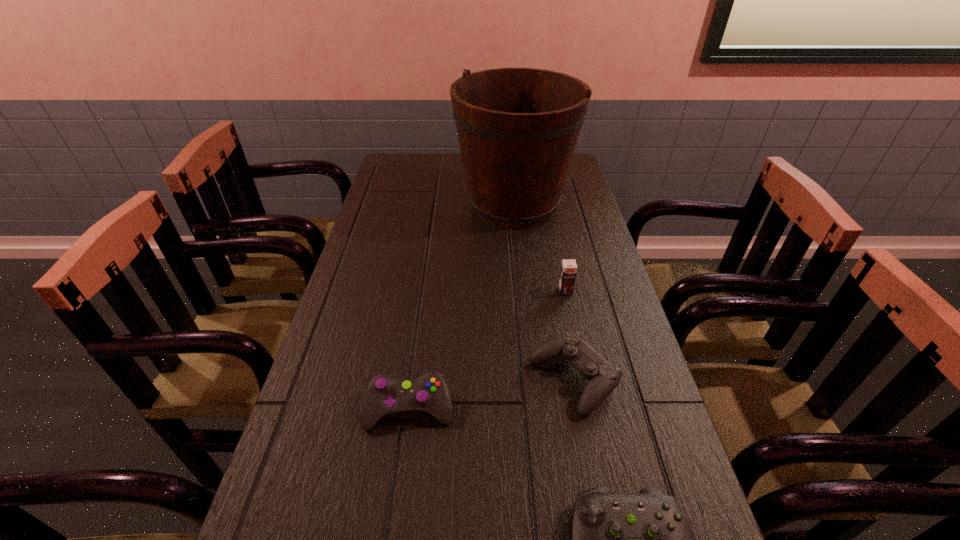
The image size is (960, 540). In order to click on blank region between the leftmost control and the fourth shortest object in this screenshot , I will do `click(488, 350)`.

You are a GUI agent. You are given a task and a screenshot of the screen. Output one action in this format:
    pyautogui.click(x=<x>, y=<y>)
    Task: Click on the empty space that is in between the leftmost control and the second farthest object
    
    Given the screenshot: What is the action you would take?
    pyautogui.click(x=488, y=350)

The height and width of the screenshot is (540, 960). What are the coordinates of `free space between the fourth shortest object and the tallest object` in the screenshot? It's located at (540, 248).

At what (x,y) coordinates should I click in order to perform the action: click on the third closest object relative to the tallest object. Please return your answer as a coordinate pair (x, y). The image size is (960, 540). Looking at the image, I should click on (385, 397).

Find the location of a particular element. object that is the fourth closest one to the tallest object is located at coordinates (619, 539).

Identify the location of the second closest control relative to the leftmost control. This screenshot has height=540, width=960. (619, 539).

At what (x,y) coordinates should I click in order to perform the action: click on control that is the nearest to the shortest object. Please return your answer as a coordinate pair (x, y). Image resolution: width=960 pixels, height=540 pixels. Looking at the image, I should click on (603, 378).